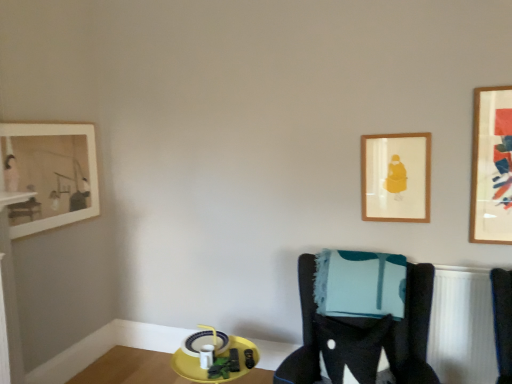
Question: Considering the relative positions of yellow plastic tray at lower center and matte white picture frame at upper left, which is the 3th picture frame from right to left, in the image provided, is yellow plastic tray at lower center to the left or to the right of matte white picture frame at upper left, which is the 3th picture frame from right to left,?

Choices:
 (A) left
 (B) right

Answer: (B)

Question: In terms of width, does yellow plastic tray at lower center look wider or thinner when compared to matte white picture frame at upper left, which is the 3th picture frame from right to left?

Choices:
 (A) wide
 (B) thin

Answer: (A)

Question: Which object is positioned farthest from the wooden framed print at upper right, marked as the 2th picture frame in a right-to-left arrangement?

Choices:
 (A) yellow plastic tray at lower center
 (B) velvet black chair at center
 (C) matte white picture frame at upper left, the 1th picture frame viewed from the left
 (D) wooden framed artwork at upper right, arranged as the third picture frame when viewed from the left

Answer: (C)

Question: Which is nearer to the yellow plastic tray at lower center?

Choices:
 (A) wooden framed artwork at upper right, arranged as the third picture frame when viewed from the left
 (B) velvet black chair at center
 (C) wooden framed print at upper right, marked as the 2th picture frame in a right-to-left arrangement
 (D) matte white picture frame at upper left, the 1th picture frame viewed from the left

Answer: (D)